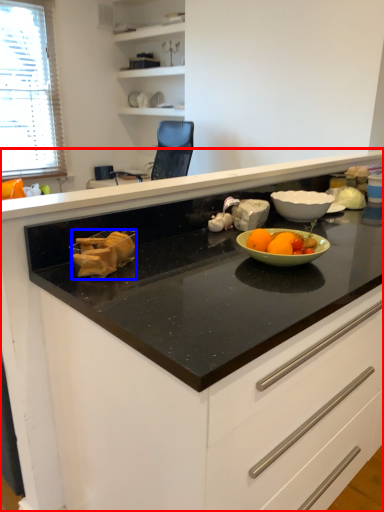
Question: Which of the following is the farthest to the observer, cabinetry (highlighted by a red box) or food (highlighted by a blue box)?

Choices:
 (A) cabinetry
 (B) food

Answer: (B)